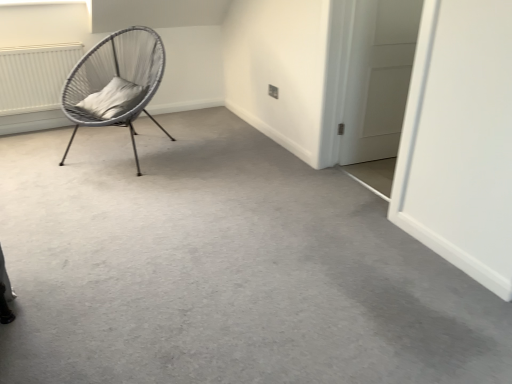
Question: Is white textured radiator at upper left positioned behind woven grey chair at left?

Choices:
 (A) no
 (B) yes

Answer: (B)

Question: From the image's perspective, is white textured radiator at upper left above woven grey chair at left?

Choices:
 (A) no
 (B) yes

Answer: (B)

Question: From a real-world perspective, is white textured radiator at upper left over woven grey chair at left?

Choices:
 (A) yes
 (B) no

Answer: (B)

Question: Considering the relative positions of white textured radiator at upper left and woven grey chair at left in the image provided, is white textured radiator at upper left to the right of woven grey chair at left from the viewer's perspective?

Choices:
 (A) yes
 (B) no

Answer: (B)

Question: From the image's perspective, would you say white textured radiator at upper left is shown under woven grey chair at left?

Choices:
 (A) no
 (B) yes

Answer: (A)

Question: From a real-world perspective, is white textured radiator at upper left beneath woven grey chair at left?

Choices:
 (A) yes
 (B) no

Answer: (A)

Question: Is white soft cushion at left at the left side of woven grey chair at left?

Choices:
 (A) no
 (B) yes

Answer: (B)

Question: Can you confirm if white soft cushion at left is taller than woven grey chair at left?

Choices:
 (A) yes
 (B) no

Answer: (B)

Question: Can you confirm if white soft cushion at left is wider than woven grey chair at left?

Choices:
 (A) yes
 (B) no

Answer: (B)

Question: From a real-world perspective, is white soft cushion at left located beneath woven grey chair at left?

Choices:
 (A) yes
 (B) no

Answer: (B)

Question: Can we say white soft cushion at left lies outside woven grey chair at left?

Choices:
 (A) yes
 (B) no

Answer: (B)

Question: From the image's perspective, would you say white soft cushion at left is positioned over woven grey chair at left?

Choices:
 (A) no
 (B) yes

Answer: (A)

Question: Is white matte door at right located outside gray carpet at center?

Choices:
 (A) yes
 (B) no

Answer: (A)